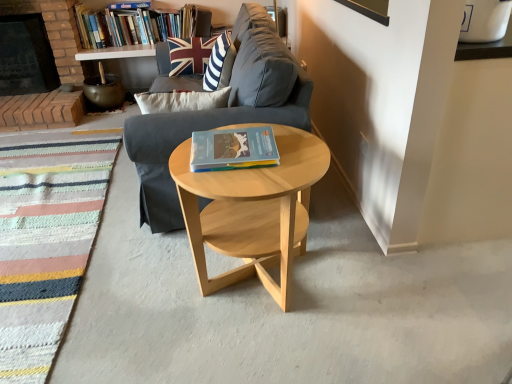
I want to click on blank space above striped fabric rug at lower left (from a real-world perspective), so click(x=39, y=204).